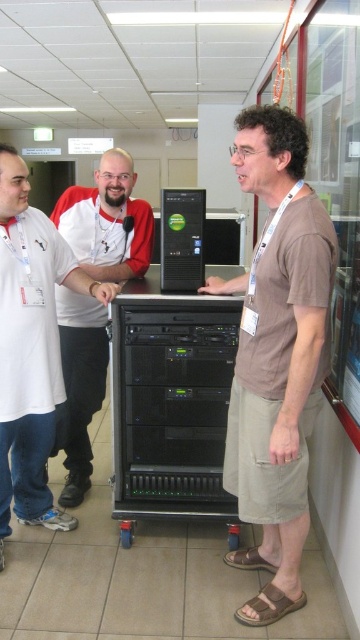
Question: Can you confirm if brown cotton shirt at center is thinner than black plastic computer at center?

Choices:
 (A) no
 (B) yes

Answer: (A)

Question: Estimate the real-world distances between objects in this image. Which object is closer to the brown cotton shirt at center?

Choices:
 (A) matte white shirt at left
 (B) matte black server at center
 (C) black plastic computer at center

Answer: (C)

Question: Does matte white shirt at left appear on the left side of matte black server at center?

Choices:
 (A) no
 (B) yes

Answer: (B)

Question: Which object is positioned closest to the black plastic computer at center?

Choices:
 (A) matte white shirt at left
 (B) brown cotton shirt at center

Answer: (B)

Question: Is brown cotton shirt at center closer to camera compared to matte black server at center?

Choices:
 (A) yes
 (B) no

Answer: (A)

Question: Which object is positioned farthest from the matte black server at center?

Choices:
 (A) brown cotton shirt at center
 (B) black plastic computer at center
 (C) matte white shirt at left

Answer: (A)